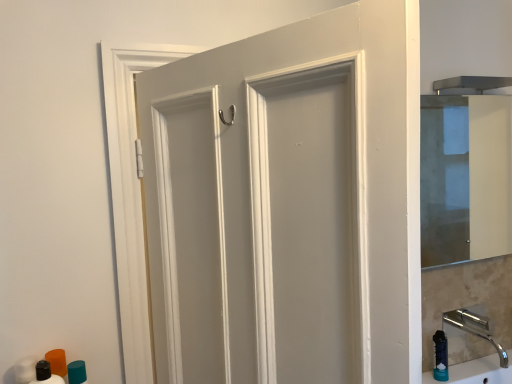
Question: From a real-world perspective, relative to matte white door at center, is teal matte cylinder at lower left, the 2th toiletry from the front, vertically above or below?

Choices:
 (A) above
 (B) below

Answer: (B)

Question: In the image, is teal matte cylinder at lower left, the 2th toiletry from the front, on the left side or the right side of matte white door at center?

Choices:
 (A) right
 (B) left

Answer: (B)

Question: Considering the real-world distances, which object is farthest from the teal matte cylinder at lower left, the 2th toiletry from the front?

Choices:
 (A) transparent glass cabinet at right
 (B) matte white door at center
 (C) matte black bottle at lower left, marked as the second toiletry in a back-to-front arrangement
 (D) polished chrome faucet at lower right
 (E) blue rubber soap dispenser at lower right

Answer: (A)

Question: Estimate the real-world distances between objects in this image. Which object is closer to the matte white door at center?

Choices:
 (A) teal matte cylinder at lower left, the 1th toiletry viewed from the back
 (B) transparent glass cabinet at right
 (C) polished chrome faucet at lower right
 (D) matte black bottle at lower left, marked as the second toiletry in a back-to-front arrangement
 (E) blue rubber soap dispenser at lower right

Answer: (D)